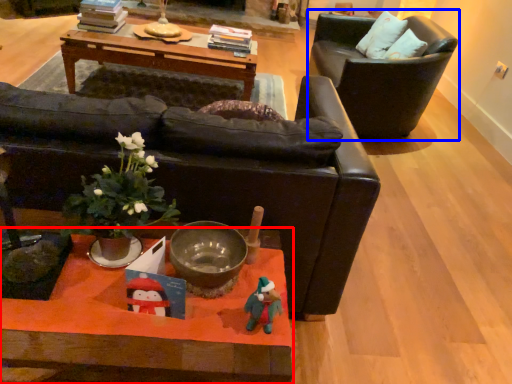
Question: Which object is closer to the camera taking this photo, coffee table (highlighted by a red box) or chair (highlighted by a blue box)?

Choices:
 (A) coffee table
 (B) chair

Answer: (A)